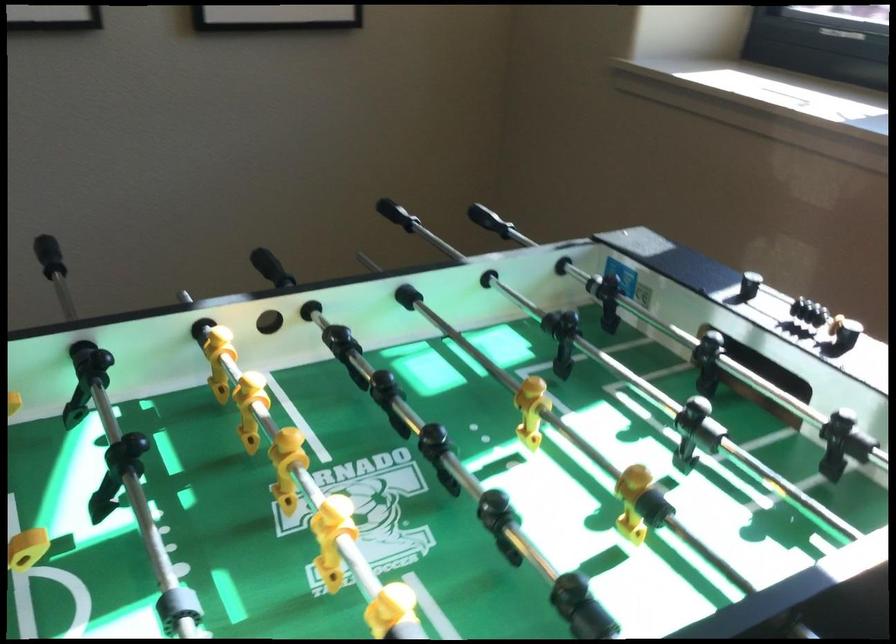
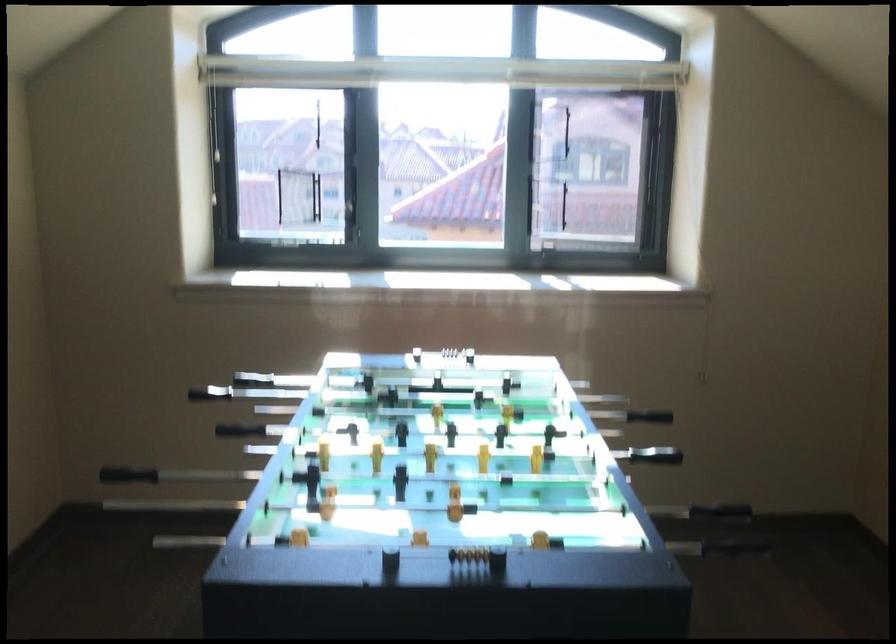
The point at [271,268] is marked in the first image. Where is the corresponding point in the second image?

(231, 428)